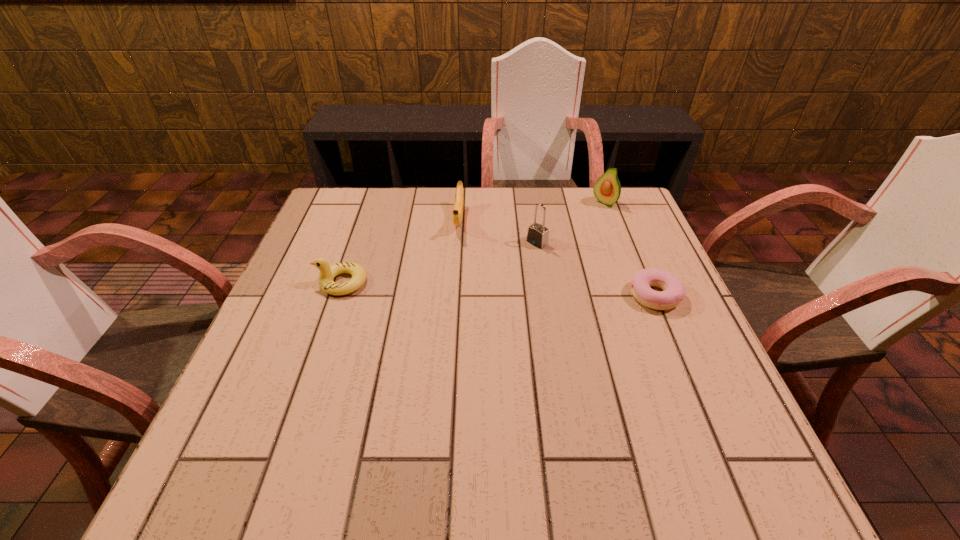
Where is `doughnut present at the right edge`? This screenshot has width=960, height=540. doughnut present at the right edge is located at coordinates (674, 291).

Find the location of a particular element. The image size is (960, 540). avocado present at the right edge is located at coordinates (607, 189).

I want to click on object that is at the far right corner, so click(x=607, y=189).

Where is `free space at the far edge`? The width and height of the screenshot is (960, 540). free space at the far edge is located at coordinates (546, 209).

Locate an element on the screen. free spot at the left edge of the desktop is located at coordinates (331, 244).

Where is `free point at the right edge`? Image resolution: width=960 pixels, height=540 pixels. free point at the right edge is located at coordinates (653, 350).

Where is `free region at the far left corner`? free region at the far left corner is located at coordinates (371, 195).

In the image, there is a desktop. Identify the location of vacant space at the near left corner. (290, 395).

This screenshot has width=960, height=540. What are the coordinates of `vacant space at the far right corner of the desktop` in the screenshot? It's located at (591, 228).

Find the location of a particular element. free space between the avocado and the banana is located at coordinates (532, 211).